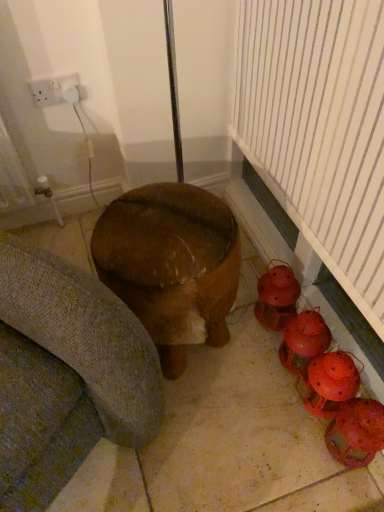
The image size is (384, 512). Describe the element at coordinates (171, 265) in the screenshot. I see `wooden stool at center` at that location.

Describe the element at coordinates (356, 432) in the screenshot. I see `matte red lantern at lower right, acting as the 1th toy starting from the bottom` at that location.

What is the approximate width of matte red lantern at lower right, the 2th toy viewed from the top?

4.99 inches.

Image resolution: width=384 pixels, height=512 pixels. In order to click on matte orange lanterns at lower right, arranged as the third toy when viewed from the top in this screenshot , I will do `click(329, 382)`.

Locate an element on the screen. This screenshot has height=512, width=384. brown polished wood stool at center is located at coordinates (227, 439).

At what (x,y) coordinates should I click in order to perform the action: click on electric outlet that is above the brown polished wood stool at center (from a real-world perspective). Please return your answer as a coordinate pair (x, y). Looking at the image, I should click on (56, 90).

Which is in front, point (120, 495) or point (61, 89)?

The point (120, 495) is closer to the camera.

What's the angular difference between brown polished wood stool at center and white plastic socket at upper left's facing directions?

The angular difference between brown polished wood stool at center and white plastic socket at upper left is 179 degrees.

Is brown polished wood stool at center looking in the opposite direction of white plastic socket at upper left?

That's not correct — brown polished wood stool at center is not looking away from white plastic socket at upper left.

What's the angular difference between matte orange lanterns at lower right, arranged as the third toy when viewed from the top, and wooden stool at center's facing directions?

The angle between the facing direction of matte orange lanterns at lower right, arranged as the third toy when viewed from the top, and the facing direction of wooden stool at center is 90 degrees.

Which of these two, matte orange lanterns at lower right, arranged as the third toy when viewed from the top, or wooden stool at center, stands shorter?

With less height is matte orange lanterns at lower right, arranged as the third toy when viewed from the top.

Looking at this image, is matte orange lanterns at lower right, placed as the second toy when sorted from bottom to top, completely or partially outside of wooden stool at center?

Yes, matte orange lanterns at lower right, placed as the second toy when sorted from bottom to top, is not within wooden stool at center.

From the picture: From the image's perspective, is matte orange lanterns at lower right, arranged as the third toy when viewed from the top, over wooden stool at center?

No, from the image's perspective, matte orange lanterns at lower right, arranged as the third toy when viewed from the top, is not on top of wooden stool at center.

Considering the relative positions of white plastic socket at upper left and matte red lantern at lower right, which ranks as the 1th toy in top-to-bottom order, in the image provided, is white plastic socket at upper left to the left of matte red lantern at lower right, which ranks as the 1th toy in top-to-bottom order, from the viewer's perspective?

Yes, white plastic socket at upper left is to the left of matte red lantern at lower right, which ranks as the 1th toy in top-to-bottom order.

Considering the relative sizes of white plastic socket at upper left and matte red lantern at lower right, the 4th toy in the bottom-to-top sequence, in the image provided, is white plastic socket at upper left thinner than matte red lantern at lower right, the 4th toy in the bottom-to-top sequence,?

Yes, white plastic socket at upper left is thinner than matte red lantern at lower right, the 4th toy in the bottom-to-top sequence.

Locate an element on the screen. electric outlet on the left of matte red lantern at lower right, which ranks as the 1th toy in top-to-bottom order is located at coordinates (56, 90).

Consider the image. Is white plastic socket at upper left taller or shorter than matte red lantern at lower right, the 4th toy in the bottom-to-top sequence?

Clearly, white plastic socket at upper left is shorter compared to matte red lantern at lower right, the 4th toy in the bottom-to-top sequence.

Can you tell me how much matte red lantern at lower right, the 3th toy from the bottom, and brown polished wood stool at center differ in facing direction?

There is a 87.5-degree angle between the facing directions of matte red lantern at lower right, the 3th toy from the bottom, and brown polished wood stool at center.

Considering the relative positions of matte red lantern at lower right, the 2th toy viewed from the top, and brown polished wood stool at center in the image provided, is matte red lantern at lower right, the 2th toy viewed from the top, to the left or to the right of brown polished wood stool at center?

matte red lantern at lower right, the 2th toy viewed from the top, is to the right of brown polished wood stool at center.

Find the location of a particular element. The height and width of the screenshot is (512, 384). the 1st toy below when counting from the brown polished wood stool at center (from the image's perspective) is located at coordinates (304, 340).

Who is taller, matte red lantern at lower right, the 2th toy viewed from the top, or brown polished wood stool at center?

matte red lantern at lower right, the 2th toy viewed from the top, is taller.

From a real-world perspective, between matte orange lanterns at lower right, placed as the second toy when sorted from bottom to top, and matte red lantern at lower right, the 4th toy in the bottom-to-top sequence, who is vertically lower?

Result: matte orange lanterns at lower right, placed as the second toy when sorted from bottom to top.

Is matte orange lanterns at lower right, placed as the second toy when sorted from bottom to top, thinner than matte red lantern at lower right, which ranks as the 1th toy in top-to-bottom order?

In fact, matte orange lanterns at lower right, placed as the second toy when sorted from bottom to top, might be wider than matte red lantern at lower right, which ranks as the 1th toy in top-to-bottom order.

The height and width of the screenshot is (512, 384). In order to click on the 2nd toy counting from the left of the matte orange lanterns at lower right, arranged as the third toy when viewed from the top in this screenshot , I will do `click(277, 297)`.

Which object is further away from the camera, matte orange lanterns at lower right, arranged as the third toy when viewed from the top, or matte red lantern at lower right, which ranks as the 1th toy in top-to-bottom order?

matte red lantern at lower right, which ranks as the 1th toy in top-to-bottom order, is more distant.

Does matte red lantern at lower right, the 2th toy viewed from the top, have a greater width compared to wooden stool at center?

In fact, matte red lantern at lower right, the 2th toy viewed from the top, might be narrower than wooden stool at center.

Is matte red lantern at lower right, the 2th toy viewed from the top, positioned beyond the bounds of wooden stool at center?

Indeed, matte red lantern at lower right, the 2th toy viewed from the top, is completely outside wooden stool at center.

Can you confirm if matte red lantern at lower right, the 2th toy viewed from the top, is bigger than wooden stool at center?

No.

From the image's perspective, between matte red lantern at lower right, the 3th toy from the bottom, and wooden stool at center, which one is located above?

wooden stool at center is shown above in the image.

Does matte red lantern at lower right, which ranks as the 1th toy in top-to-bottom order, turn towards white plastic socket at upper left?

No, matte red lantern at lower right, which ranks as the 1th toy in top-to-bottom order, is not oriented towards white plastic socket at upper left.

From a real-world perspective, is matte red lantern at lower right, which ranks as the 1th toy in top-to-bottom order, above or below white plastic socket at upper left?

matte red lantern at lower right, which ranks as the 1th toy in top-to-bottom order, is below white plastic socket at upper left.

Locate an element on the screen. The height and width of the screenshot is (512, 384). concrete in front of the white plastic socket at upper left is located at coordinates (227, 439).

Image resolution: width=384 pixels, height=512 pixels. In order to click on the 3rd toy below the wooden stool at center (from the image's perspective) in this screenshot , I will do `click(329, 382)`.

From the image, which object appears to be farther from matte red lantern at lower right, acting as the 1th toy starting from the bottom, matte red lantern at lower right, the 4th toy in the bottom-to-top sequence, or matte orange lanterns at lower right, arranged as the third toy when viewed from the top?

matte red lantern at lower right, the 4th toy in the bottom-to-top sequence, is further to matte red lantern at lower right, acting as the 1th toy starting from the bottom.

Which object lies nearer to the anchor point matte orange lanterns at lower right, arranged as the third toy when viewed from the top, wooden stool at center or matte red lantern at lower right, marked as the 4th toy in a top-to-bottom arrangement?

The object closer to matte orange lanterns at lower right, arranged as the third toy when viewed from the top, is matte red lantern at lower right, marked as the 4th toy in a top-to-bottom arrangement.

Estimate the real-world distances between objects in this image. Which object is further from wooden stool at center, brown polished wood stool at center or white plastic socket at upper left?

Based on the image, white plastic socket at upper left appears to be further to wooden stool at center.

In the scene shown: Based on their spatial positions, is matte red lantern at lower right, the 3th toy from the bottom, or brown polished wood stool at center closer to matte red lantern at lower right, acting as the 1th toy starting from the bottom?

matte red lantern at lower right, the 3th toy from the bottom.

Based on their spatial positions, is wooden stool at center or matte red lantern at lower right, marked as the 4th toy in a top-to-bottom arrangement, further from matte red lantern at lower right, the 3th toy from the bottom?

wooden stool at center lies further to matte red lantern at lower right, the 3th toy from the bottom, than the other object.

Looking at the image, which one is located further to matte orange lanterns at lower right, placed as the second toy when sorted from bottom to top, brown polished wood stool at center or matte red lantern at lower right, acting as the 1th toy starting from the bottom?

Based on the image, brown polished wood stool at center appears to be further to matte orange lanterns at lower right, placed as the second toy when sorted from bottom to top.

Based on their spatial positions, is matte red lantern at lower right, which ranks as the 1th toy in top-to-bottom order, or matte red lantern at lower right, the 3th toy from the bottom, closer to brown polished wood stool at center?

Based on the image, matte red lantern at lower right, the 3th toy from the bottom, appears to be nearer to brown polished wood stool at center.

From the image, which object appears to be nearer to matte red lantern at lower right, the 3th toy from the bottom, matte orange lanterns at lower right, arranged as the third toy when viewed from the top, or white plastic socket at upper left?

Based on the image, matte orange lanterns at lower right, arranged as the third toy when viewed from the top, appears to be nearer to matte red lantern at lower right, the 3th toy from the bottom.

Find the location of a particular element. furniture between brown polished wood stool at center and matte red lantern at lower right, the 4th toy in the bottom-to-top sequence, in the horizontal direction is located at coordinates (171, 265).

The width and height of the screenshot is (384, 512). What are the coordinates of `toy that lies between white plastic socket at upper left and brown polished wood stool at center from top to bottom` in the screenshot? It's located at (277, 297).

Where is `furniture situated between brown polished wood stool at center and matte red lantern at lower right, marked as the 4th toy in a top-to-bottom arrangement, from left to right`? furniture situated between brown polished wood stool at center and matte red lantern at lower right, marked as the 4th toy in a top-to-bottom arrangement, from left to right is located at coordinates (171, 265).

The height and width of the screenshot is (512, 384). In order to click on toy between matte red lantern at lower right, the 2th toy viewed from the top, and matte red lantern at lower right, marked as the 4th toy in a top-to-bottom arrangement, in the vertical direction in this screenshot , I will do `click(329, 382)`.